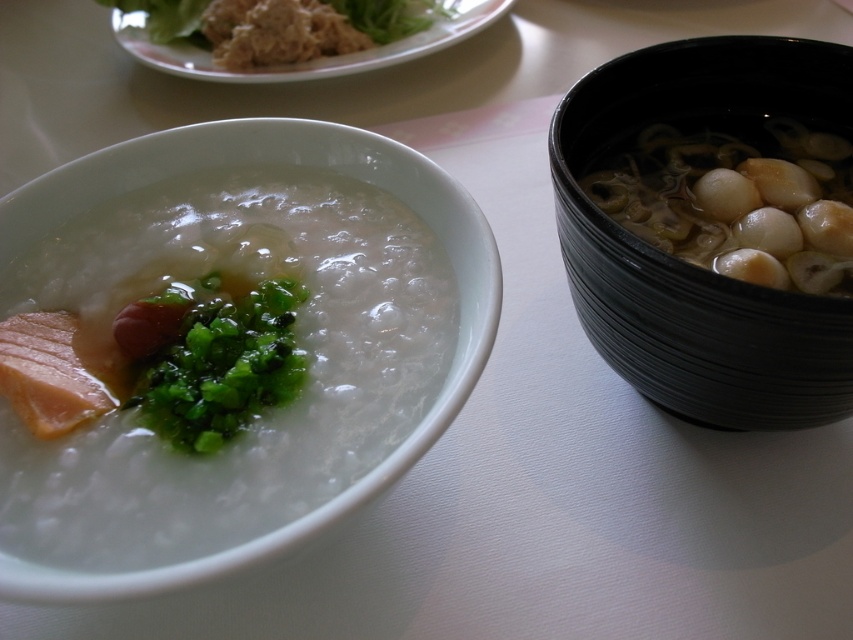
Question: Can you confirm if white glossy bowl at center is positioned above green leafymaterial/texture at left?

Choices:
 (A) no
 (B) yes

Answer: (B)

Question: Among these objects, which one is nearest to the camera?

Choices:
 (A) white glossy ball at right
 (B) green leafymaterial/texture at left
 (C) black glossy bowl at right

Answer: (B)

Question: Which point is farther to the camera?

Choices:
 (A) 469,209
 (B) 717,115
 (C) 663,196
 (D) 202,275

Answer: (B)

Question: In this image, where is white glossy bowl at center located relative to green leafymaterial/texture at left?

Choices:
 (A) left
 (B) right

Answer: (B)

Question: Which point is farther to the camera?

Choices:
 (A) green leafymaterial/texture at left
 (B) white glossy bowl at center
 (C) black glossy bowl at right
 (D) white glossy ball at right

Answer: (D)

Question: Is white glossy bowl at center positioned before white glossy ball at right?

Choices:
 (A) yes
 (B) no

Answer: (A)